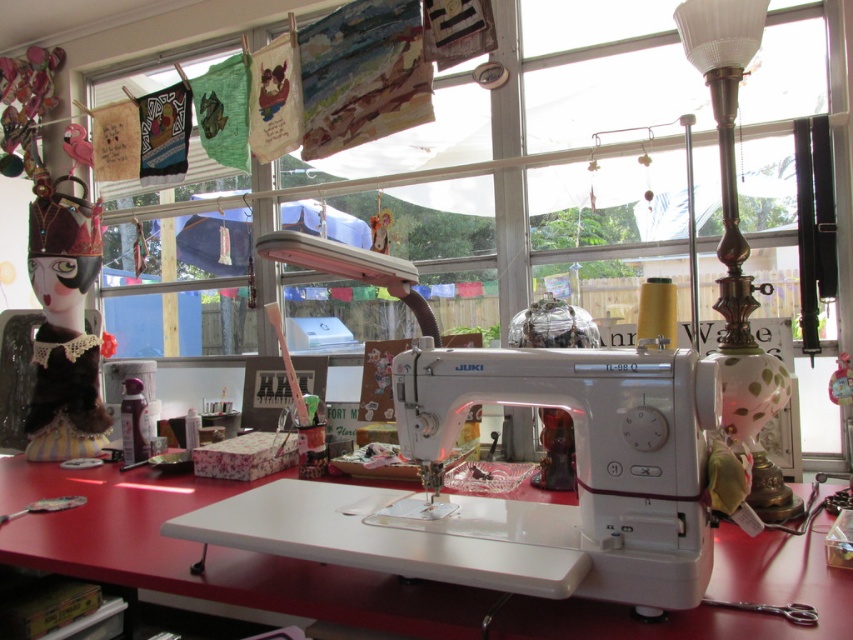
Can you confirm if transparent plastic window at center is positioned to the left of polished brass lamp at right?

Correct, you'll find transparent plastic window at center to the left of polished brass lamp at right.

Does point (653, 104) lie in front of point (718, 84)?

No.

The height and width of the screenshot is (640, 853). Identify the location of transparent plastic window at center. (537, 166).

Is point (595, 534) more distant than point (796, 577)?

No, (595, 534) is in front of (796, 577).

Based on the photo, measure the distance from white plastic sewing machine at center to white plastic table at center.

white plastic sewing machine at center is 9.31 inches away from white plastic table at center.

Is point (697, 440) farther from viewer compared to point (467, 628)?

Yes, point (697, 440) is behind point (467, 628).

This screenshot has height=640, width=853. Identify the location of white plastic sewing machine at center. (517, 500).

Who is positioned more to the right, transparent plastic window at center or white plastic table at center?

transparent plastic window at center

Is the position of transparent plastic window at center more distant than that of white plastic table at center?

Yes.

Between point (779, 10) and point (183, 508), which one is positioned behind?

Point (779, 10)

Where is `transparent plastic window at center`? Image resolution: width=853 pixels, height=640 pixels. transparent plastic window at center is located at coordinates (537, 166).